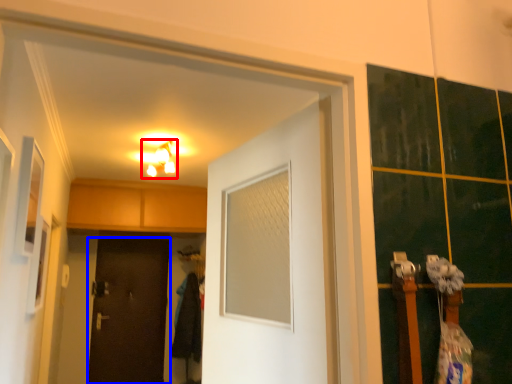
Question: Among these objects, which one is nearest to the camera, light fixture (highlighted by a red box) or door (highlighted by a blue box)?

Choices:
 (A) light fixture
 (B) door

Answer: (A)